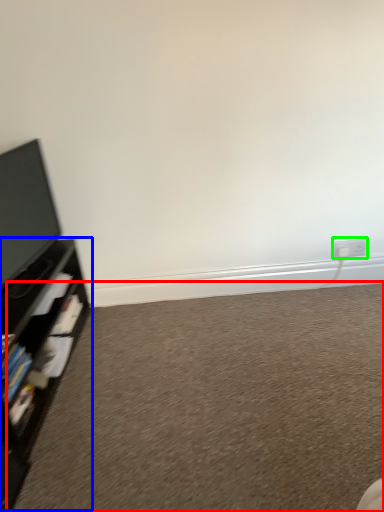
Question: Which object is positioned closest to plain (highlighted by a red box)? Select from shelf (highlighted by a blue box) and electric outlet (highlighted by a green box).

Choices:
 (A) shelf
 (B) electric outlet

Answer: (A)